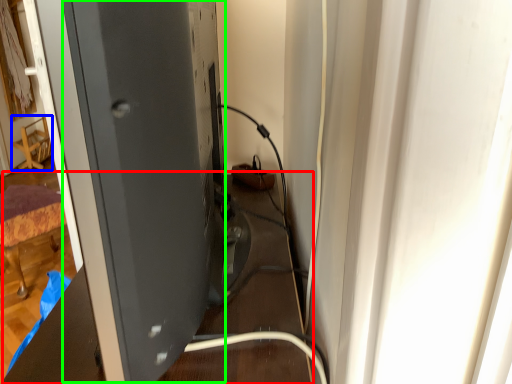
Question: Which object is the closest to the table (highlighted by a red box)? Choose among these: furniture (highlighted by a blue box) or wide (highlighted by a green box).

Choices:
 (A) furniture
 (B) wide

Answer: (B)